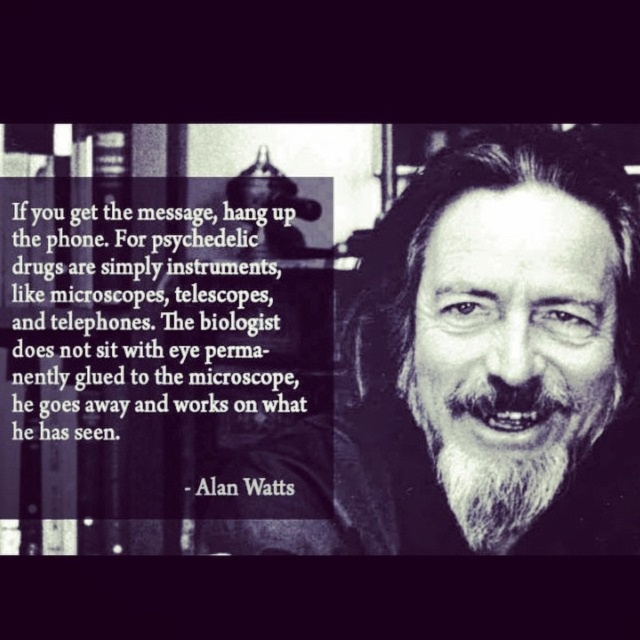
You are a delivery person who needs to place a small package on the desk in the study. The desk is located at the position marked by point (376, 470). However, there is a lamp on the desk. Can you place the package there without moving the lamp?

The point (376, 470) is 1.42 meters away from the viewer. Since the desk is at that point and there is a lamp there, you can place the package on the desk at point (376, 470) as long as there is enough space next to the lamp.

Looking at the image, which object is wider between the white beard at right and the black paper at upper left?

The white beard at right is wider than the black paper at upper left according to the description provided.

Based on the scene described, what is located at the coordinates point (166,310)?

The black paper at upper left is located at point (166,310).